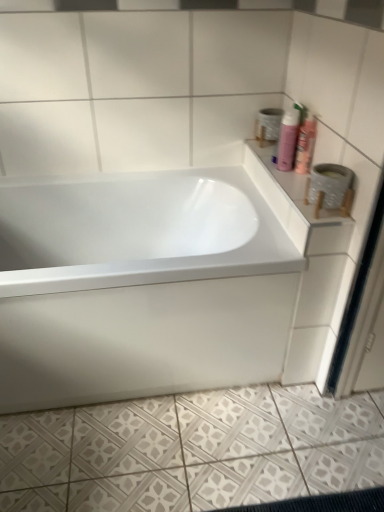
Question: From the image's perspective, is pink matte shaving cream at upper right, the 1th shaving cream in the left-to-right sequence, on white textured toilet paper at upper right?

Choices:
 (A) yes
 (B) no

Answer: (A)

Question: From a real-world perspective, is pink matte shaving cream at upper right, the 1th shaving cream in the left-to-right sequence, beneath white textured toilet paper at upper right?

Choices:
 (A) no
 (B) yes

Answer: (A)

Question: From a real-world perspective, is pink matte shaving cream at upper right, the 1th shaving cream in the left-to-right sequence, on top of white textured toilet paper at upper right?

Choices:
 (A) yes
 (B) no

Answer: (A)

Question: Can you confirm if pink matte shaving cream at upper right, the 1th shaving cream in the left-to-right sequence, is wider than white textured toilet paper at upper right?

Choices:
 (A) no
 (B) yes

Answer: (A)

Question: Is pink matte shaving cream at upper right, which is the second shaving cream in right-to-left order, oriented away from white textured toilet paper at upper right?

Choices:
 (A) yes
 (B) no

Answer: (B)

Question: Considering the relative positions of pink matte shaving cream at upper right, the 1th shaving cream in the left-to-right sequence, and pink matte shaving cream at upper right, the 1th shaving cream from the right, in the image provided, is pink matte shaving cream at upper right, the 1th shaving cream in the left-to-right sequence, to the left or to the right of pink matte shaving cream at upper right, the 1th shaving cream from the right,?

Choices:
 (A) left
 (B) right

Answer: (A)

Question: From a real-world perspective, is pink matte shaving cream at upper right, the 1th shaving cream in the left-to-right sequence, positioned above or below pink matte shaving cream at upper right, which appears as the 2th shaving cream when viewed from the left?

Choices:
 (A) above
 (B) below

Answer: (B)

Question: Based on their sizes in the image, would you say pink matte shaving cream at upper right, which is the second shaving cream in right-to-left order, is bigger or smaller than pink matte shaving cream at upper right, which appears as the 2th shaving cream when viewed from the left?

Choices:
 (A) big
 (B) small

Answer: (A)

Question: Considering their positions, is pink matte shaving cream at upper right, the 1th shaving cream in the left-to-right sequence, located in front of or behind pink matte shaving cream at upper right, the 1th shaving cream from the right?

Choices:
 (A) front
 (B) behind

Answer: (B)

Question: Does point (288, 158) appear closer or farther from the camera than point (312, 440)?

Choices:
 (A) closer
 (B) farther

Answer: (B)

Question: Considering their positions, is pink matte shaving cream at upper right, the 1th shaving cream in the left-to-right sequence, located in front of or behind white textured tile at lower center?

Choices:
 (A) behind
 (B) front

Answer: (A)

Question: From the image's perspective, is pink matte shaving cream at upper right, which is the second shaving cream in right-to-left order, above or below white textured tile at lower center?

Choices:
 (A) below
 (B) above

Answer: (B)

Question: Looking at their shapes, would you say pink matte shaving cream at upper right, which is the second shaving cream in right-to-left order, is wider or thinner than white textured tile at lower center?

Choices:
 (A) wide
 (B) thin

Answer: (B)

Question: From a real-world perspective, is white textured tile at lower center physically located above or below white glossy counter top at upper right?

Choices:
 (A) below
 (B) above

Answer: (A)

Question: From the image's perspective, relative to white glossy counter top at upper right, is white textured tile at lower center above or below?

Choices:
 (A) above
 (B) below

Answer: (B)